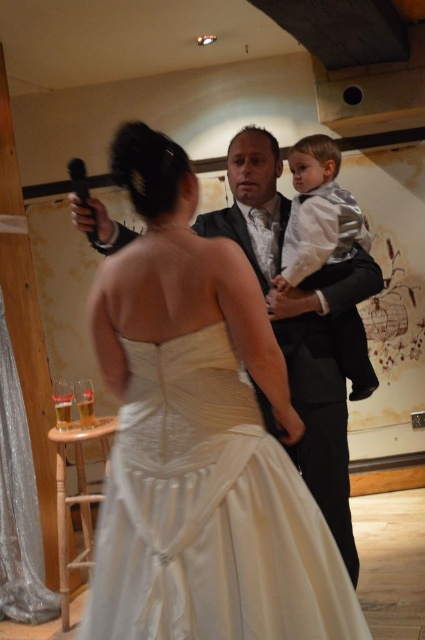
Question: Which object is farther from the camera taking this photo?

Choices:
 (A) silver shiny suit at center
 (B) satin dress at center

Answer: (A)

Question: Does satin dress at center have a lesser width compared to silver shiny suit at center?

Choices:
 (A) no
 (B) yes

Answer: (A)

Question: Which point is farther to the camera?

Choices:
 (A) satin dress at center
 (B) silver shiny suit at center

Answer: (B)

Question: Where is satin dress at center located in relation to silver shiny suit at center in the image?

Choices:
 (A) below
 (B) above

Answer: (A)

Question: Which object appears closest to the camera in this image?

Choices:
 (A) satin dress at center
 (B) silver shiny suit at center

Answer: (A)

Question: Considering the relative positions of satin dress at center and silver shiny suit at center in the image provided, where is satin dress at center located with respect to silver shiny suit at center?

Choices:
 (A) below
 (B) above

Answer: (A)